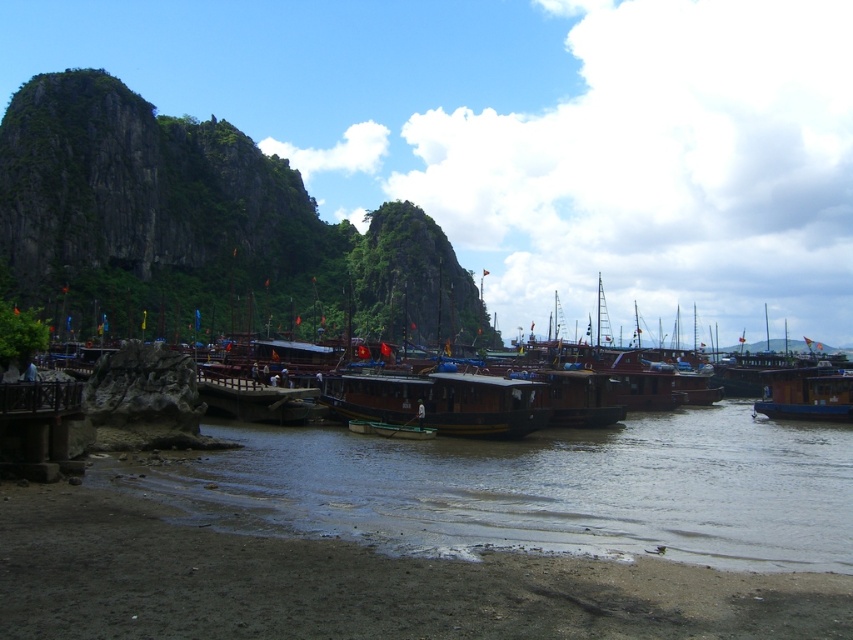
Question: Does brown wooden boat at right have a smaller size compared to green wooden boat at center?

Choices:
 (A) yes
 (B) no

Answer: (B)

Question: Which object is closer to the camera taking this photo?

Choices:
 (A) brown wooden boat at center
 (B) green wooden boat at center

Answer: (A)

Question: Does brown wooden boat at right appear on the left side of green wooden boat at center?

Choices:
 (A) no
 (B) yes

Answer: (A)

Question: Which of the following is the closest to the observer?

Choices:
 (A) (822, 381)
 (B) (403, 433)

Answer: (B)

Question: Is brown wooden boat at center below green wooden boat at center?

Choices:
 (A) no
 (B) yes

Answer: (A)

Question: Which point appears farthest from the camera in this image?

Choices:
 (A) (341, 396)
 (B) (805, 404)
 (C) (367, 420)

Answer: (B)